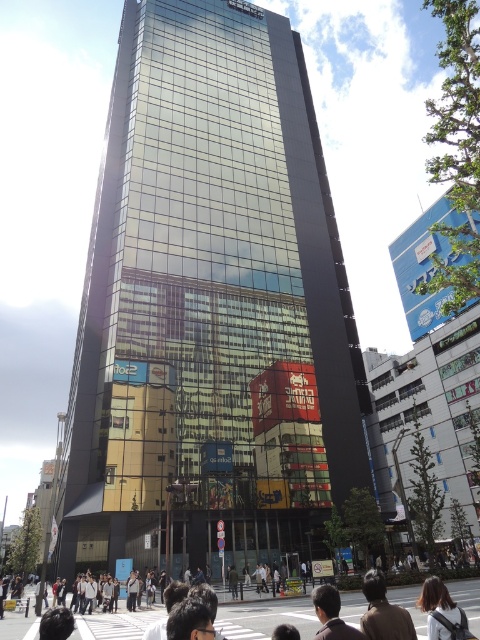
Question: Does brown hair at lower right have a lesser width compared to dark brown hair at lower center?

Choices:
 (A) yes
 (B) no

Answer: (B)

Question: Which object appears closest to the camera in this image?

Choices:
 (A) brown hair at lower right
 (B) dark brown hair at lower center

Answer: (B)

Question: Can you confirm if glassy metallic skyscraper at center is smaller than brown leather jacket at lower center?

Choices:
 (A) yes
 (B) no

Answer: (B)

Question: Based on their relative distances, which object is nearer to the brown hair at lower right?

Choices:
 (A) dark brown hair at lower center
 (B) glassy metallic skyscraper at center
 (C) brown leather jacket at lower center

Answer: (C)

Question: Among these points, which one is farthest from the camera?

Choices:
 (A) coord(128,268)
 (B) coord(436,616)
 (C) coord(393,627)

Answer: (A)

Question: Where is brown hair at lower right located in relation to dark brown hair at lower center in the image?

Choices:
 (A) below
 (B) above

Answer: (A)